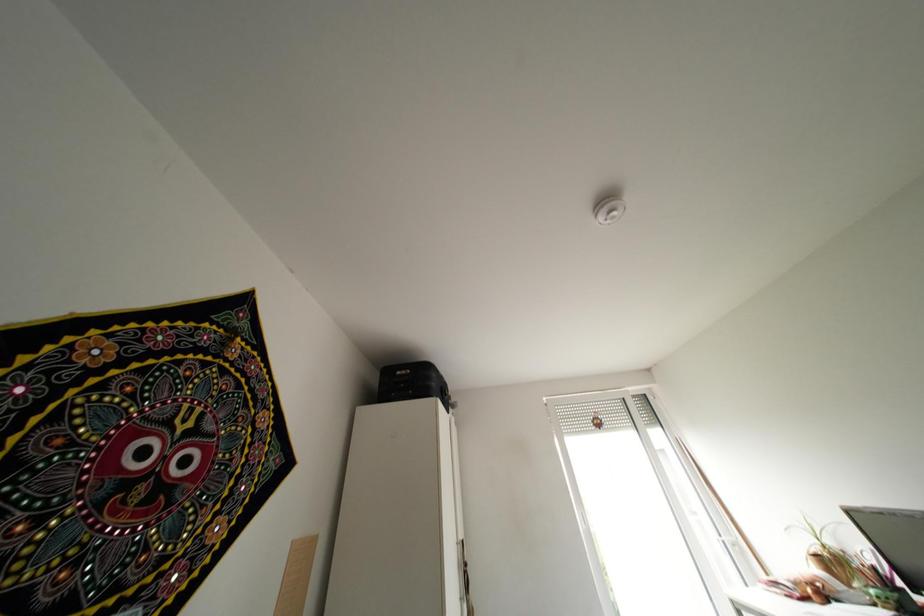
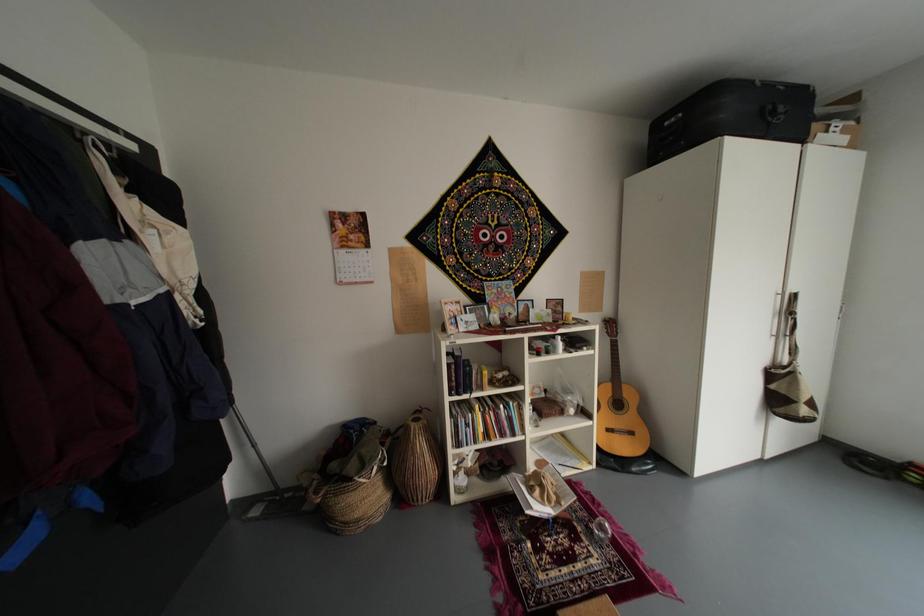
How did the camera likely rotate?

The camera rotated toward left-down.